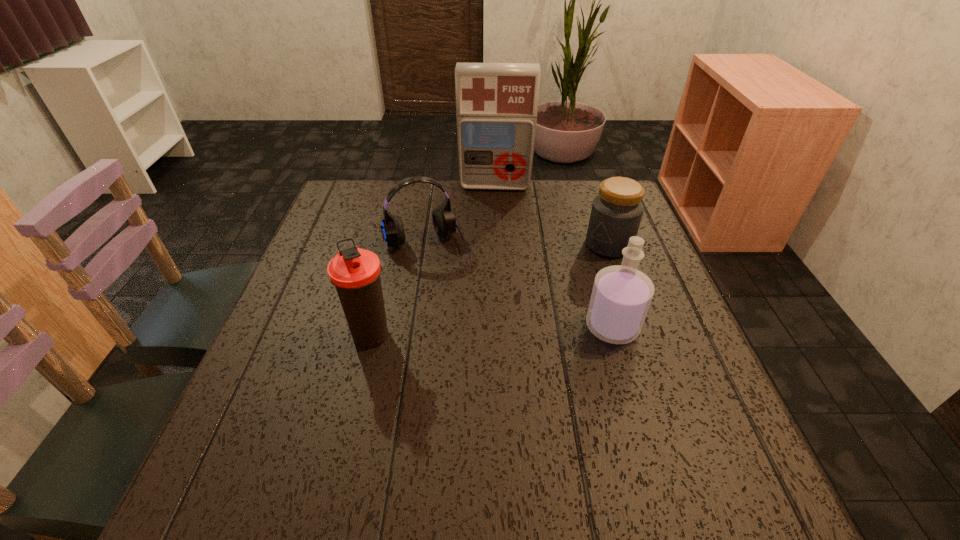
The height and width of the screenshot is (540, 960). I want to click on thermos bottle, so click(x=355, y=272).

Locate an element on the screen. perfume is located at coordinates (621, 295).

Locate an element on the screen. headset is located at coordinates (444, 220).

The image size is (960, 540). In order to click on jar in this screenshot , I will do `click(617, 210)`.

This screenshot has height=540, width=960. Find the location of `the first-aid kit`. the first-aid kit is located at coordinates coord(496,103).

Identify the location of the tallest object. (496, 103).

Find the location of a particular element. This screenshot has height=540, width=960. free space located 0.400m on the back of the thermos bottle is located at coordinates (400, 214).

I want to click on free location located on the back of the perfume, so click(x=580, y=217).

Locate an element on the screen. This screenshot has width=960, height=540. vacant space located on the ear cushions of the headset is located at coordinates (468, 335).

In order to click on free space located on the ear cushions of the headset in this screenshot , I will do `click(465, 329)`.